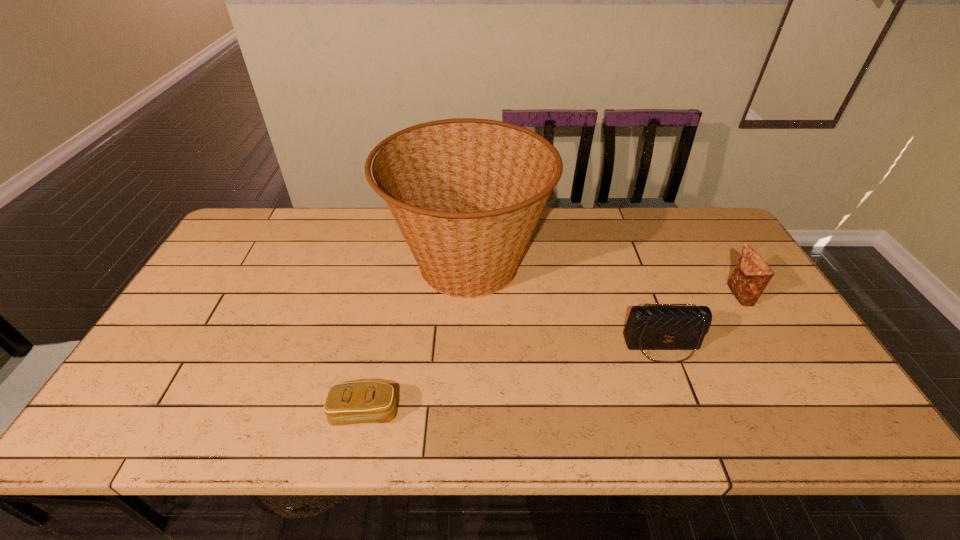
Where is `blank space at the near left corner`? blank space at the near left corner is located at coordinates (138, 430).

This screenshot has height=540, width=960. Identify the location of vacant position at the far right corner of the desktop. (702, 236).

This screenshot has width=960, height=540. I want to click on free space between the second nearest clutch bag and the basket, so click(x=564, y=305).

You are a GUI agent. You are given a task and a screenshot of the screen. Output one action in this format:
    pyautogui.click(x=<x>, y=<y>)
    Task: Click on the vacant region between the tallest clutch bag and the shortest object
    This screenshot has height=540, width=960.
    Given the screenshot: What is the action you would take?
    pyautogui.click(x=552, y=354)

Identify the location of vacant space that's between the second clutch bag from right to left and the tallest object. (564, 305).

Locate an element on the screen. The height and width of the screenshot is (540, 960). free point between the tallest object and the shortest object is located at coordinates (416, 339).

You are a GUI agent. You are given a task and a screenshot of the screen. Output one action in this format:
    pyautogui.click(x=<x>, y=<y>)
    Task: Click on the vacant space that is in between the tallest object and the shortest clutch bag
    The height and width of the screenshot is (540, 960).
    Given the screenshot: What is the action you would take?
    pyautogui.click(x=416, y=339)

This screenshot has height=540, width=960. I want to click on blank region between the tallest object and the leftmost clutch bag, so click(x=416, y=339).

Where is `blank region between the second shortest object and the tallest object`? This screenshot has width=960, height=540. blank region between the second shortest object and the tallest object is located at coordinates (564, 305).

Where is `vacant area that lies between the second tallest object and the leftmost clutch bag`? This screenshot has height=540, width=960. vacant area that lies between the second tallest object and the leftmost clutch bag is located at coordinates (552, 354).